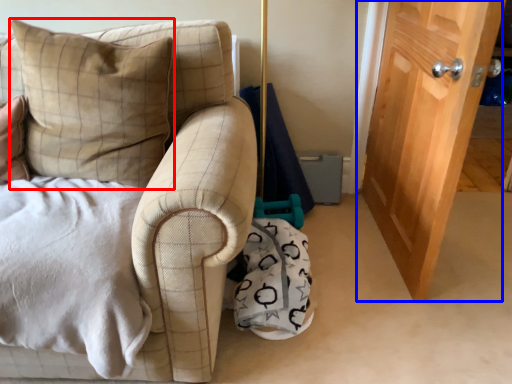
Question: Which object appears closest to the camera in this image, pillow (highlighted by a red box) or door (highlighted by a blue box)?

Choices:
 (A) pillow
 (B) door

Answer: (A)